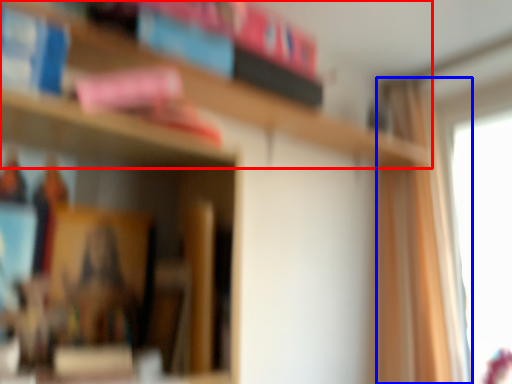
Question: Which object appears farthest to the camera in this image, bookcase (highlighted by a red box) or curtain (highlighted by a blue box)?

Choices:
 (A) bookcase
 (B) curtain

Answer: (B)